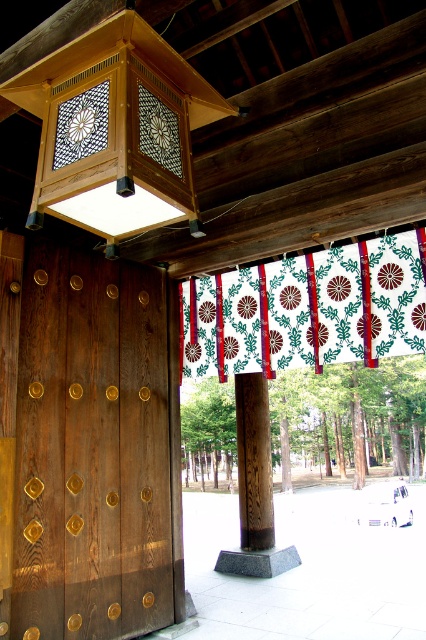
Where is the dark brown wood at center located in the image?

The dark brown wood at center is located at point (92, 449) in the image.

You are standing in front of a traditional Japanese gate and see the dark brown wood at center and the white fabric with floral pattern at center. You want to place a small offering box between them. Can the offering box fit in the space between them?

The dark brown wood at center and white fabric with floral pattern at center are 3.88 feet apart, so the offering box can fit in the space between them since 3.88 feet is sufficient for placement.